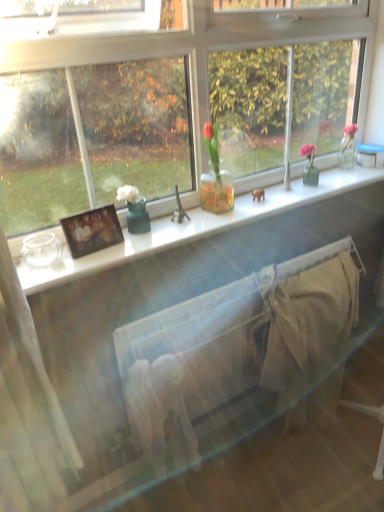
Question: Is white glossy window sill at center surrounding white fabric bed frame at center?

Choices:
 (A) no
 (B) yes

Answer: (A)

Question: From the image's perspective, does white glossy window sill at center appear higher than white fabric bed frame at center?

Choices:
 (A) yes
 (B) no

Answer: (A)

Question: Is white fabric bed frame at center at the back of white glossy window sill at center?

Choices:
 (A) yes
 (B) no

Answer: (B)

Question: Would you say white glossy window sill at center is outside white fabric bed frame at center?

Choices:
 (A) no
 (B) yes

Answer: (B)

Question: Can you confirm if white glossy window sill at center is bigger than white fabric bed frame at center?

Choices:
 (A) no
 (B) yes

Answer: (A)

Question: From the image's perspective, is white glossy window sill at center located above or below white fabric bed frame at center?

Choices:
 (A) below
 (B) above

Answer: (B)

Question: Considering the positions of white glossy window sill at center and white fabric bed frame at center in the image, is white glossy window sill at center wider or thinner than white fabric bed frame at center?

Choices:
 (A) wide
 (B) thin

Answer: (A)

Question: Considering the positions of white glossy window sill at center and white fabric bed frame at center in the image, is white glossy window sill at center taller or shorter than white fabric bed frame at center?

Choices:
 (A) tall
 (B) short

Answer: (B)

Question: From a real-world perspective, is white glossy window sill at center physically located above or below white fabric bed frame at center?

Choices:
 (A) above
 (B) below

Answer: (A)

Question: In terms of size, does matte wooden picture frame at left appear bigger or smaller than white glossy window sill at center?

Choices:
 (A) big
 (B) small

Answer: (B)

Question: Considering the positions of matte wooden picture frame at left and white glossy window sill at center in the image, is matte wooden picture frame at left wider or thinner than white glossy window sill at center?

Choices:
 (A) thin
 (B) wide

Answer: (A)

Question: Would you say matte wooden picture frame at left is to the left or to the right of white glossy window sill at center in the picture?

Choices:
 (A) right
 (B) left

Answer: (B)

Question: From a real-world perspective, is matte wooden picture frame at left physically located above or below white glossy window sill at center?

Choices:
 (A) below
 (B) above

Answer: (B)

Question: Is white glossy window sill at center inside the boundaries of beige cotton blanket at lower right, or outside?

Choices:
 (A) inside
 (B) outside

Answer: (B)

Question: Considering their positions, is white glossy window sill at center located in front of or behind beige cotton blanket at lower right?

Choices:
 (A) behind
 (B) front

Answer: (B)